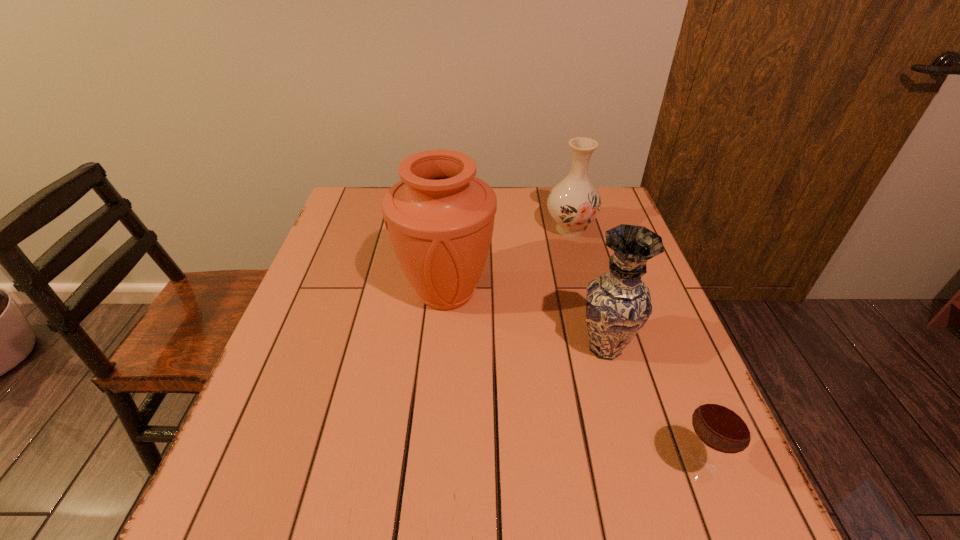
Locate an element on the screen. The height and width of the screenshot is (540, 960). the leftmost vase is located at coordinates (440, 217).

Where is `the farthest vase`? Image resolution: width=960 pixels, height=540 pixels. the farthest vase is located at coordinates (573, 203).

Locate an element on the screen. wineglass is located at coordinates (723, 423).

Find the location of a particular element. This screenshot has width=960, height=540. the shortest object is located at coordinates (723, 423).

The height and width of the screenshot is (540, 960). What are the coordinates of `blank space located 0.230m on the right of the leftmost object` in the screenshot? It's located at (586, 292).

This screenshot has width=960, height=540. In order to click on vacant space located 0.070m on the front of the farthest vase in this screenshot , I will do `click(578, 260)`.

The height and width of the screenshot is (540, 960). I want to click on vacant space located 0.140m on the back of the nearest object, so click(664, 379).

The width and height of the screenshot is (960, 540). Find the location of `object present at the far edge`. object present at the far edge is located at coordinates (573, 203).

Find the location of a particular element. The width and height of the screenshot is (960, 540). wineglass at the right edge is located at coordinates (723, 423).

I want to click on object that is at the far right corner, so click(x=573, y=203).